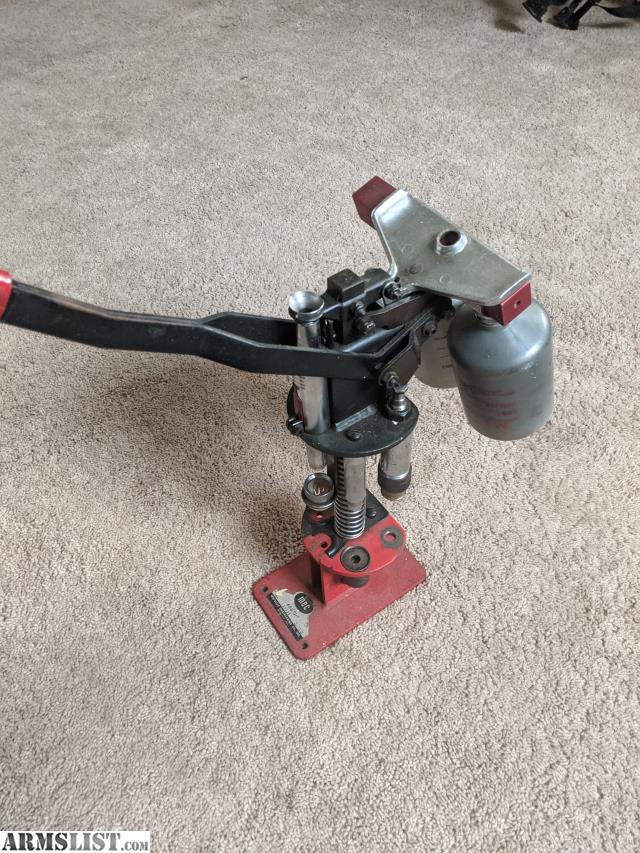
Identify the location of canisters. (505, 380), (440, 357).